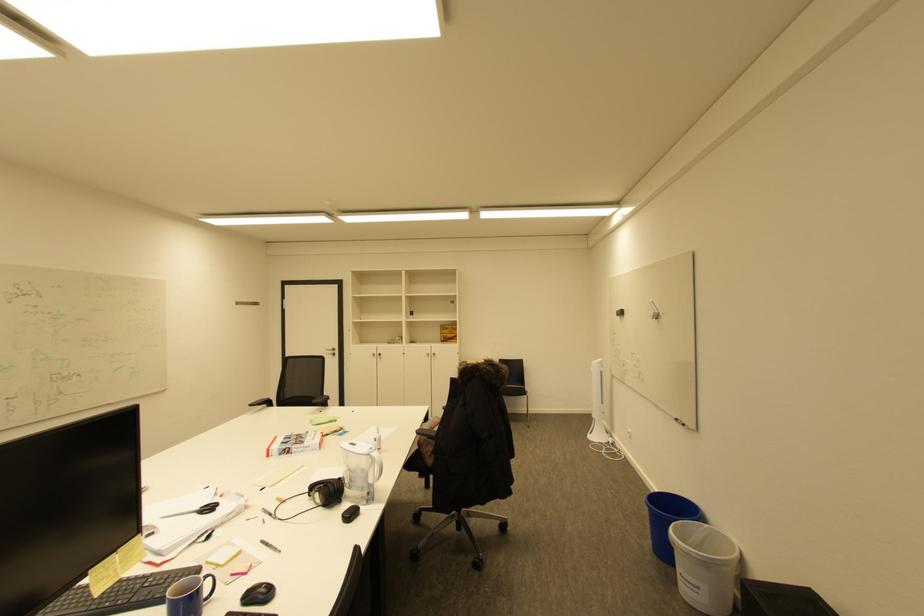
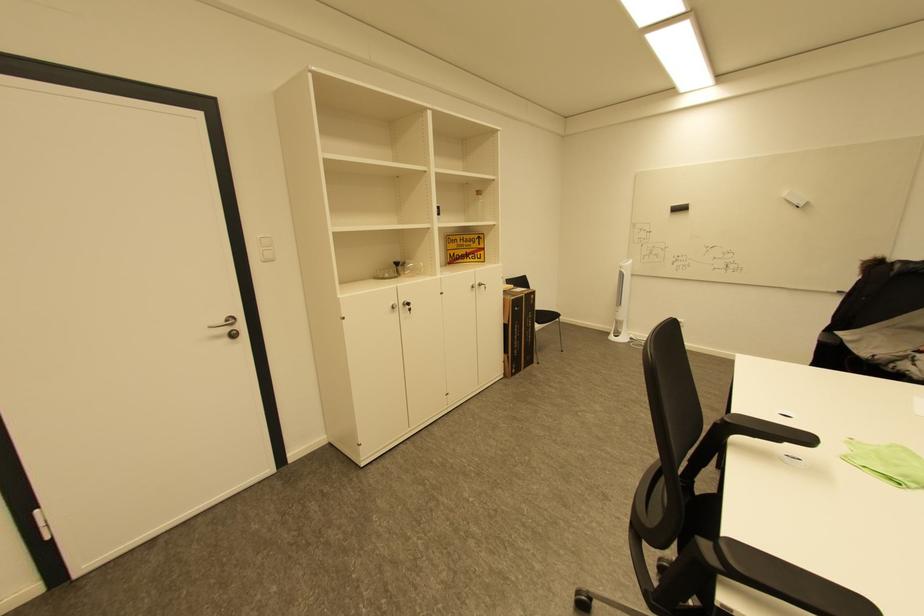
In the second image, find the point that corresponds to point (627, 314) in the first image.

(686, 209)